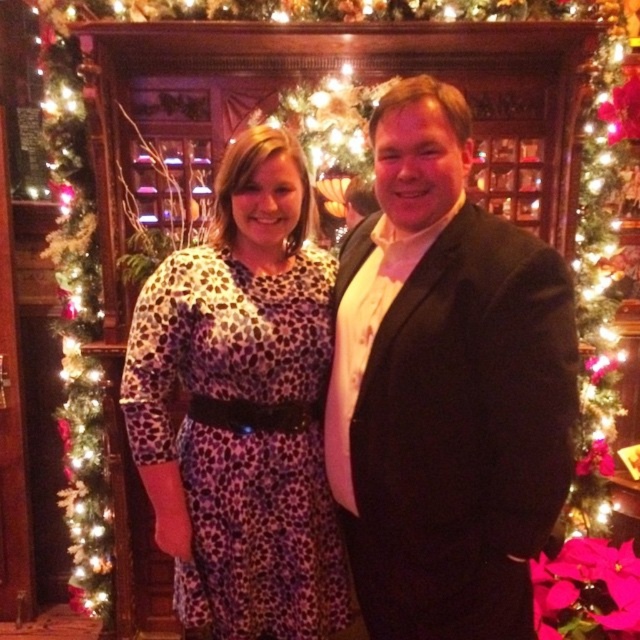
You are planning to take a photo of the green artificial christmas tree at left and the green garland at left. Which one is placed higher in the scene?

The green artificial christmas tree at left is positioned over the green garland at left, so it is placed higher in the scene.

In the festive indoor scene with two people, there is a green artificial christmas tree at left and a green garland at left. Which of these two items is shorter?

The green artificial christmas tree at left is shorter than the green garland at left.

You are a photographer setting up for a holiday photo shoot. You need to position a spotlight so that it illuminates both the leopard print fabric dress at center and the green garland at left without casting shadows on the background. Based on their positions, where should you place the spotlight relative to these objects?

The leopard print fabric dress at center is below the green garland at left. To avoid casting shadows on the background, place the spotlight above and slightly to the right of both objects so that light falls evenly on both without creating shadows behind them.